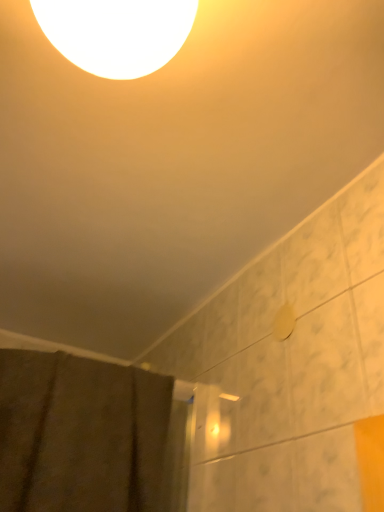
This screenshot has height=512, width=384. What are the coordinates of `white glossy light at upper center` in the screenshot? It's located at (116, 33).

What do you see at coordinates (116, 33) in the screenshot? I see `white glossy light at upper center` at bounding box center [116, 33].

You are a GUI agent. You are given a task and a screenshot of the screen. Output one action in this format:
    pyautogui.click(x=<x>, y=<y>)
    Task: Click on the brown textured fabric at lower left
    Image resolution: width=384 pixels, height=512 pixels.
    Given the screenshot: What is the action you would take?
    pyautogui.click(x=80, y=434)

Image resolution: width=384 pixels, height=512 pixels. Describe the element at coordinates (80, 434) in the screenshot. I see `brown textured fabric at lower left` at that location.

This screenshot has width=384, height=512. I want to click on white glossy light at upper center, so click(116, 33).

Would you say white glossy light at upper center is to the left or to the right of brown textured fabric at lower left in the picture?

white glossy light at upper center is to the right of brown textured fabric at lower left.

Who is more distant, white glossy light at upper center or brown textured fabric at lower left?

brown textured fabric at lower left is more distant.

Is point (72, 12) farther from camera compared to point (143, 376)?

No, (72, 12) is in front of (143, 376).

From the image's perspective, is white glossy light at upper center on top of brown textured fabric at lower left?

Yes, from the image's perspective, white glossy light at upper center is above brown textured fabric at lower left.

From a real-world perspective, is white glossy light at upper center beneath brown textured fabric at lower left?

No.

Which of these two, white glossy light at upper center or brown textured fabric at lower left, is wider?

Wider between the two is brown textured fabric at lower left.

Considering the relative sizes of white glossy light at upper center and brown textured fabric at lower left in the image provided, is white glossy light at upper center shorter than brown textured fabric at lower left?

Correct, white glossy light at upper center is not as tall as brown textured fabric at lower left.

Who is bigger, white glossy light at upper center or brown textured fabric at lower left?

brown textured fabric at lower left.

Based on the photo, would you say white glossy light at upper center is inside or outside brown textured fabric at lower left?

white glossy light at upper center is outside brown textured fabric at lower left.

Are white glossy light at upper center and brown textured fabric at lower left beside each other?

white glossy light at upper center and brown textured fabric at lower left are clearly separated.

Is white glossy light at upper center looking in the opposite direction of brown textured fabric at lower left?

white glossy light at upper center is not turned away from brown textured fabric at lower left.

The height and width of the screenshot is (512, 384). In order to click on shower curtain that appears behind the white glossy light at upper center in this screenshot , I will do `click(80, 434)`.

In the scene shown: Which object is positioned more to the right, brown textured fabric at lower left or white glossy light at upper center?

From the viewer's perspective, white glossy light at upper center appears more on the right side.

In the scene shown: Considering the positions of objects brown textured fabric at lower left and white glossy light at upper center in the image provided, who is behind, brown textured fabric at lower left or white glossy light at upper center?

Positioned behind is brown textured fabric at lower left.

Which is in front, point (43, 494) or point (168, 34)?

The point (168, 34) is more forward.

From the image's perspective, is brown textured fabric at lower left beneath white glossy light at upper center?

Yes, from the image's perspective, brown textured fabric at lower left is beneath white glossy light at upper center.

From a real-world perspective, who is located higher, brown textured fabric at lower left or white glossy light at upper center?

white glossy light at upper center.

Can you confirm if brown textured fabric at lower left is thinner than white glossy light at upper center?

No.

Which of these two, brown textured fabric at lower left or white glossy light at upper center, stands shorter?

white glossy light at upper center.

Considering the sizes of brown textured fabric at lower left and white glossy light at upper center in the image, is brown textured fabric at lower left bigger or smaller than white glossy light at upper center?

Clearly, brown textured fabric at lower left is larger in size than white glossy light at upper center.

Is brown textured fabric at lower left situated inside white glossy light at upper center or outside?

brown textured fabric at lower left is not inside white glossy light at upper center, it's outside.

Is brown textured fabric at lower left not near white glossy light at upper center?

A: No, there isn't a large distance between brown textured fabric at lower left and white glossy light at upper center.

Is brown textured fabric at lower left aimed at white glossy light at upper center?

Yes, brown textured fabric at lower left faces towards white glossy light at upper center.

This screenshot has width=384, height=512. In order to click on shower curtain lying below the white glossy light at upper center (from the image's perspective) in this screenshot , I will do `click(80, 434)`.

Locate an element on the screen. shower curtain located behind the white glossy light at upper center is located at coordinates (80, 434).

Locate an element on the screen. The image size is (384, 512). lamp in front of the brown textured fabric at lower left is located at coordinates (116, 33).